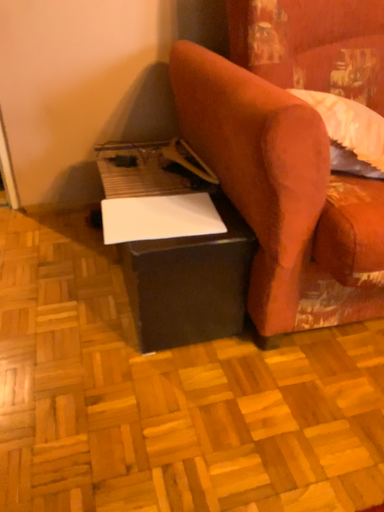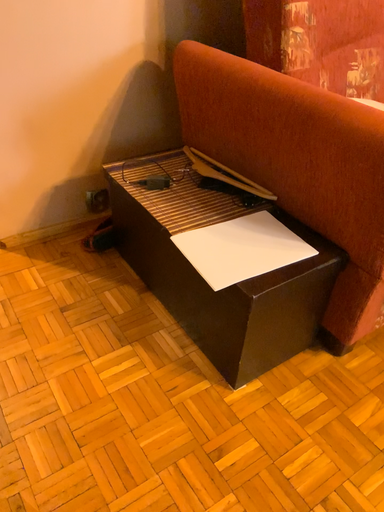
Question: How did the camera likely rotate when shooting the video?

Choices:
 (A) rotated left
 (B) rotated right

Answer: (B)